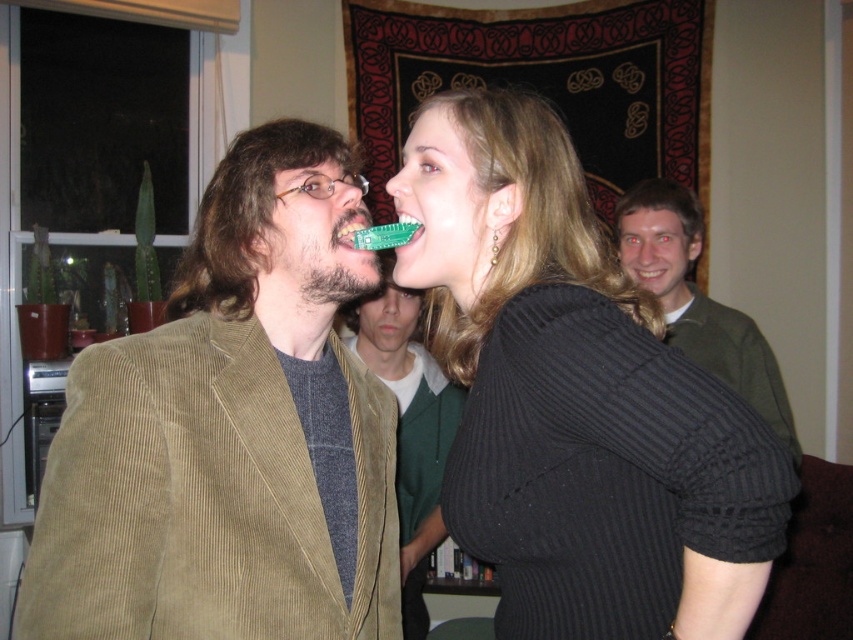
You are taking a photo of two points in the scene. The first point is at coordinates point (422, 387) and the second is at point (679, 291). Which point will appear larger in your photo?

Point (422, 387) is closer to the camera than point (679, 291), so it will appear larger in the photo.

You are a photographer setting up a shoot in this scene. You need to position a spotlight so that it illuminates the beige corduroy blazer at left without shining on the green corduroy jacket at upper right. Based on their positions, is this possible?

The beige corduroy blazer at left is in front of the green corduroy jacket at upper right, so you can position the spotlight to shine on the beige corduroy blazer at left without affecting the green corduroy jacket at upper right.

You are organizing a clothing donation drive and need to know if the green corduroy jacket at center and the green corduroy jacket at upper right can fit side by side on a shelf that is 1.2 meters wide. Based on their sizes, can both jackets fit?

The green corduroy jacket at center is narrower than the green corduroy jacket at upper right. Since the total width of both jackets combined would depend on their individual measurements, but the problem does not provide exact widths. However, if the sum of their widths is less than or equal to 1.2 meters, they can fit. Without specific measurements, we cannot confirm definitively.